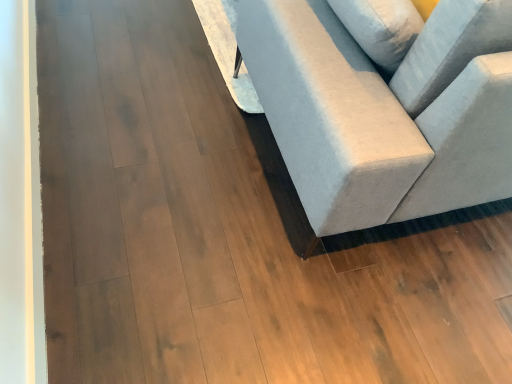
Identify the location of vacant space situated on the left part of light gray fabric couch at right. (143, 87).